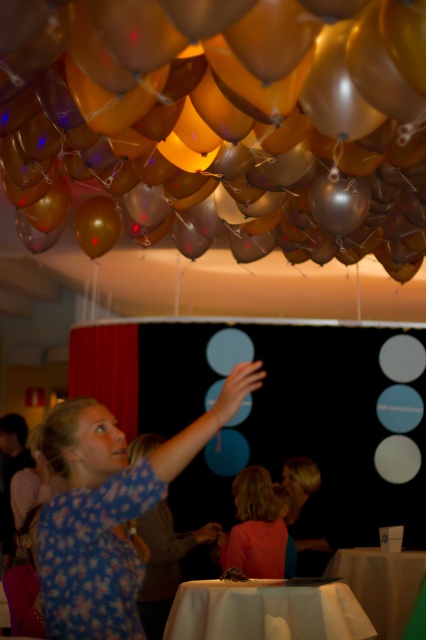
Question: Which object appears closest to the camera in this image?

Choices:
 (A) white cloth table at lower center
 (B) smooth beige table at lower center

Answer: (A)

Question: Is translucent metallic balloon at upper center positioned before white cloth table at lower center?

Choices:
 (A) no
 (B) yes

Answer: (B)

Question: Does floral fabric shirt at center have a lesser width compared to white cloth table at lower center?

Choices:
 (A) no
 (B) yes

Answer: (B)

Question: Among these objects, which one is farthest from the camera?

Choices:
 (A) translucent metallic balloon at upper center
 (B) orange fabric child at lower center

Answer: (B)

Question: Which object is the farthest from the white cloth table at lower center?

Choices:
 (A) orange fabric child at lower center
 (B) translucent metallic balloon at upper center
 (C) smooth beige table at lower center
 (D) floral fabric shirt at center

Answer: (B)

Question: Does translucent metallic balloon at upper center have a greater width compared to floral fabric shirt at center?

Choices:
 (A) no
 (B) yes

Answer: (B)